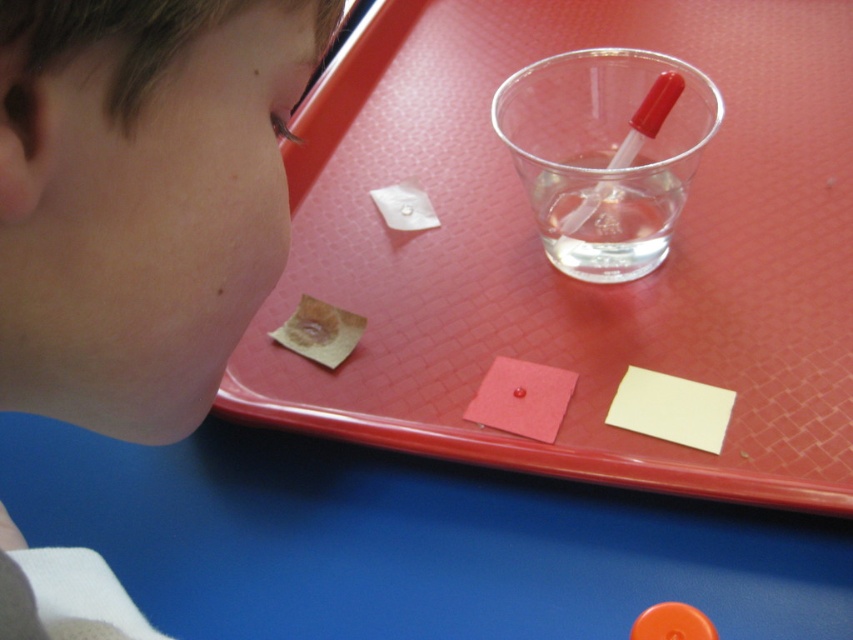
Does transparent plastic cup at upper right appear under transparent liquid at center?

No, transparent plastic cup at upper right is not below transparent liquid at center.

In the scene shown: Can you confirm if transparent plastic cup at upper right is thinner than transparent liquid at center?

No, transparent plastic cup at upper right is not thinner than transparent liquid at center.

Between point (558, 266) and point (541, 205), which one is positioned in front?

Point (541, 205)

Where is `transparent plastic cup at upper right`? transparent plastic cup at upper right is located at coordinates (606, 154).

Does smooth skin at upper left have a larger size compared to transparent plastic cup at upper right?

Indeed, smooth skin at upper left has a larger size compared to transparent plastic cup at upper right.

Consider the image. Is smooth skin at upper left below transparent plastic cup at upper right?

Yes.

This screenshot has height=640, width=853. Describe the element at coordinates (140, 198) in the screenshot. I see `smooth skin at upper left` at that location.

Image resolution: width=853 pixels, height=640 pixels. I want to click on smooth skin at upper left, so click(x=140, y=198).

Does smooth skin at upper left appear under transparent liquid at center?

Yes, smooth skin at upper left is below transparent liquid at center.

Is smooth skin at upper left positioned before transparent liquid at center?

Yes, smooth skin at upper left is in front of transparent liquid at center.

You are a GUI agent. You are given a task and a screenshot of the screen. Output one action in this format:
    pyautogui.click(x=<x>, y=<y>)
    Task: Click on the smooth skin at upper left
    The height and width of the screenshot is (640, 853).
    Given the screenshot: What is the action you would take?
    pyautogui.click(x=140, y=198)